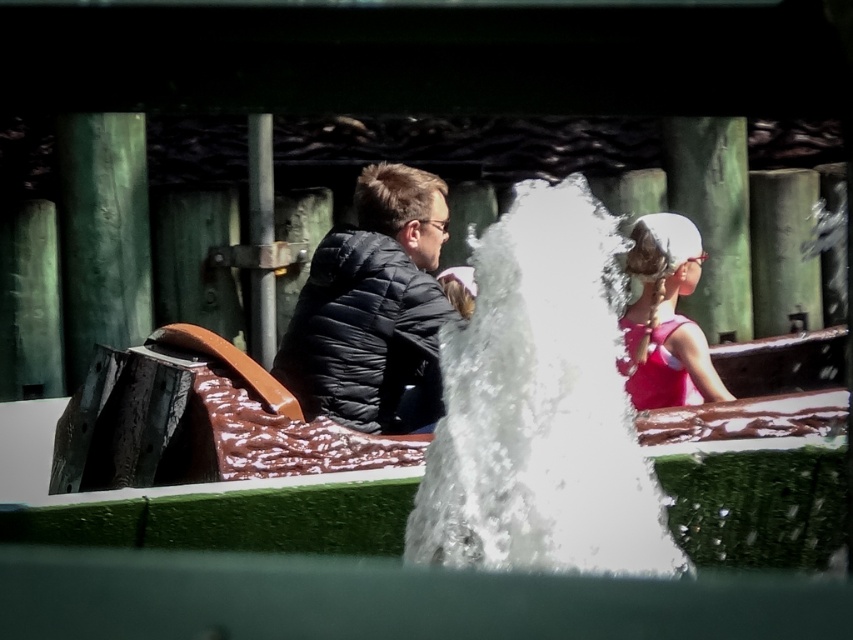
Is white frothy water at center closer to camera compared to black puffer jacket at center?

Yes, white frothy water at center is closer to the viewer.

Between white frothy water at center and black puffer jacket at center, which one has more height?

Standing taller between the two is white frothy water at center.

Locate an element on the screen. white frothy water at center is located at coordinates (540, 406).

Identify the location of white frothy water at center. (540, 406).

Can you confirm if white frothy water at center is positioned to the right of pink fabric hair at upper right?

In fact, white frothy water at center is to the left of pink fabric hair at upper right.

Does white frothy water at center have a greater width compared to pink fabric hair at upper right?

Indeed, white frothy water at center has a greater width compared to pink fabric hair at upper right.

This screenshot has height=640, width=853. What do you see at coordinates (540, 406) in the screenshot?
I see `white frothy water at center` at bounding box center [540, 406].

At what (x,y) coordinates should I click in order to perform the action: click on white frothy water at center. Please return your answer as a coordinate pair (x, y). The height and width of the screenshot is (640, 853). Looking at the image, I should click on (540, 406).

Can you confirm if white frothy water at center is shorter than matte black jacket at center?

No, white frothy water at center is not shorter than matte black jacket at center.

Does white frothy water at center come in front of matte black jacket at center?

Yes, white frothy water at center is in front of matte black jacket at center.

Identify the location of white frothy water at center. The height and width of the screenshot is (640, 853). click(x=540, y=406).